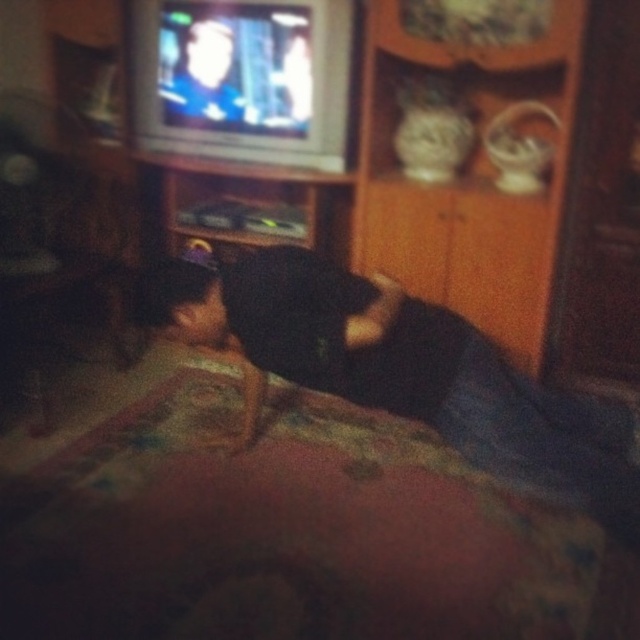
In the dimly lit room scene, there is a dark fabric at center and a smooth skin man at upper center. Based on their positions, which object is located to the right of the other?

The dark fabric at center is located to the right of the smooth skin man at upper center.

You are a guest in this room and want to place a small lamp between the dark fabric at center and the smooth skin man at upper center. Is there enough space to place it vertically between them?

The dark fabric at center is located below the smooth skin man at upper center, so there is vertical space between them. You can place the lamp vertically between the dark fabric at center and the smooth skin man at upper center.

You are a photographer adjusting your camera to focus on two points in the image. The first point is at coordinates point (400, 294) and the second is at point (237, 112). Which point should you focus on first if you want to capture the closest object to the camera?

Point (400, 294) is closer to the camera than point (237, 112), so you should focus on point (400, 294) first to capture the closest object.